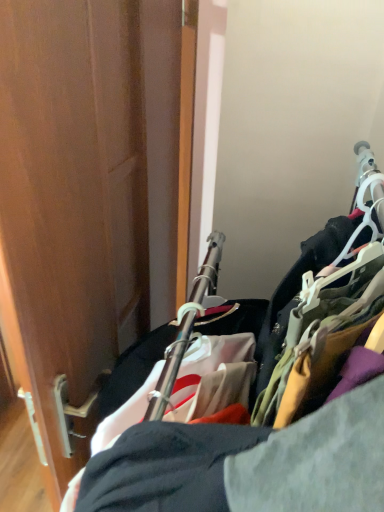
Question: Considering the relative positions of cloth hangers at right and wooden door at left in the image provided, is cloth hangers at right to the left of wooden door at left from the viewer's perspective?

Choices:
 (A) yes
 (B) no

Answer: (B)

Question: From the image's perspective, is cloth hangers at right on top of wooden door at left?

Choices:
 (A) no
 (B) yes

Answer: (A)

Question: Does cloth hangers at right touch wooden door at left?

Choices:
 (A) yes
 (B) no

Answer: (B)

Question: From a real-world perspective, is cloth hangers at right beneath wooden door at left?

Choices:
 (A) no
 (B) yes

Answer: (B)

Question: Is cloth hangers at right positioned in front of wooden door at left?

Choices:
 (A) no
 (B) yes

Answer: (B)

Question: Can you confirm if cloth hangers at right is thinner than wooden door at left?

Choices:
 (A) no
 (B) yes

Answer: (A)

Question: Is wooden door at left smaller than cloth hangers at right?

Choices:
 (A) no
 (B) yes

Answer: (B)

Question: From a real-world perspective, is wooden door at left on cloth hangers at right?

Choices:
 (A) yes
 (B) no

Answer: (A)

Question: Is wooden door at left placed right next to cloth hangers at right?

Choices:
 (A) yes
 (B) no

Answer: (B)

Question: Does wooden door at left have a greater height compared to cloth hangers at right?

Choices:
 (A) yes
 (B) no

Answer: (B)

Question: Would you say wooden door at left contains cloth hangers at right?

Choices:
 (A) yes
 (B) no

Answer: (B)

Question: Does wooden door at left lie behind cloth hangers at right?

Choices:
 (A) no
 (B) yes

Answer: (B)

Question: From the image's perspective, is cloth hangers at right above or below wooden door at left?

Choices:
 (A) above
 (B) below

Answer: (B)